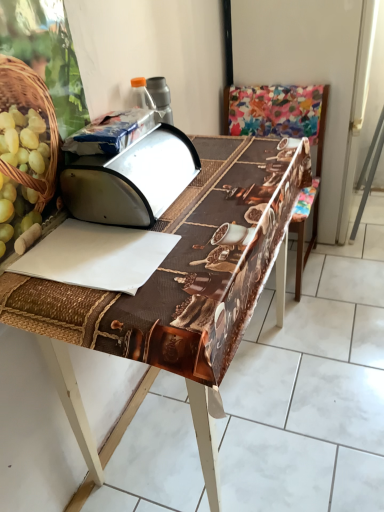
Question: Can you confirm if blue plastic bag at upper center, which is the 1th wrapping paper in top-to-bottom order, is positioned to the left of multicolored fabric chair at center?

Choices:
 (A) yes
 (B) no

Answer: (A)

Question: From the image's perspective, does blue plastic bag at upper center, which is the 1th wrapping paper in top-to-bottom order, appear lower than multicolored fabric chair at center?

Choices:
 (A) yes
 (B) no

Answer: (B)

Question: From the image's perspective, does blue plastic bag at upper center, positioned as the 2th wrapping paper in bottom-to-top order, appear higher than multicolored fabric chair at center?

Choices:
 (A) no
 (B) yes

Answer: (B)

Question: Is multicolored fabric chair at center a part of blue plastic bag at upper center, positioned as the 2th wrapping paper in bottom-to-top order?

Choices:
 (A) yes
 (B) no

Answer: (B)

Question: Is blue plastic bag at upper center, which is the 1th wrapping paper in top-to-bottom order, smaller than multicolored fabric chair at center?

Choices:
 (A) yes
 (B) no

Answer: (A)

Question: From the image's perspective, is brown woven table at center located above or below white paper at center, the first wrapping paper in the bottom-to-top sequence?

Choices:
 (A) below
 (B) above

Answer: (A)

Question: Based on their sizes in the image, would you say brown woven table at center is bigger or smaller than white paper at center, the first wrapping paper in the bottom-to-top sequence?

Choices:
 (A) big
 (B) small

Answer: (A)

Question: Is brown woven table at center wider or thinner than white paper at center, the first wrapping paper in the bottom-to-top sequence?

Choices:
 (A) thin
 (B) wide

Answer: (B)

Question: Is brown woven table at center in front of or behind white paper at center, which ranks as the second wrapping paper in top-to-bottom order, in the image?

Choices:
 (A) behind
 (B) front

Answer: (B)

Question: Is metallic silver breadbox at center in front of or behind white paper at center, which ranks as the second wrapping paper in top-to-bottom order, in the image?

Choices:
 (A) front
 (B) behind

Answer: (B)

Question: Considering the positions of metallic silver breadbox at center and white paper at center, the first wrapping paper in the bottom-to-top sequence, in the image, is metallic silver breadbox at center wider or thinner than white paper at center, the first wrapping paper in the bottom-to-top sequence,?

Choices:
 (A) thin
 (B) wide

Answer: (A)

Question: From a real-world perspective, is metallic silver breadbox at center above or below white paper at center, which ranks as the second wrapping paper in top-to-bottom order?

Choices:
 (A) below
 (B) above

Answer: (B)

Question: From their relative heights in the image, would you say metallic silver breadbox at center is taller or shorter than white paper at center, the first wrapping paper in the bottom-to-top sequence?

Choices:
 (A) tall
 (B) short

Answer: (A)

Question: Is brown woven table at center in front of or behind blue plastic bag at upper center, which is the 1th wrapping paper in top-to-bottom order, in the image?

Choices:
 (A) front
 (B) behind

Answer: (A)

Question: Would you say brown woven table at center is inside or outside blue plastic bag at upper center, which is the 1th wrapping paper in top-to-bottom order?

Choices:
 (A) outside
 (B) inside

Answer: (A)